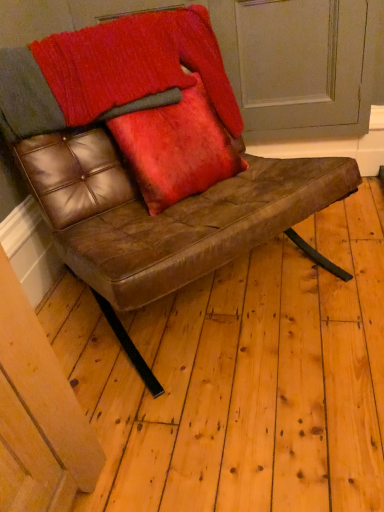
Question: Is brown leather chair at center aimed at velvet red cushion at center?

Choices:
 (A) no
 (B) yes

Answer: (B)

Question: Is brown leather chair at center smaller than velvet red cushion at center?

Choices:
 (A) yes
 (B) no

Answer: (B)

Question: Is brown leather chair at center facing away from velvet red cushion at center?

Choices:
 (A) no
 (B) yes

Answer: (B)

Question: Does brown leather chair at center appear on the right side of velvet red cushion at center?

Choices:
 (A) no
 (B) yes

Answer: (A)

Question: Can you confirm if brown leather chair at center is shorter than velvet red cushion at center?

Choices:
 (A) yes
 (B) no

Answer: (B)

Question: Does brown leather chair at center have a lesser width compared to velvet red cushion at center?

Choices:
 (A) yes
 (B) no

Answer: (B)

Question: Can you confirm if velvet red cushion at center is positioned to the right of brown leather chair at center?

Choices:
 (A) yes
 (B) no

Answer: (A)

Question: Is velvet red cushion at center looking in the opposite direction of brown leather chair at center?

Choices:
 (A) no
 (B) yes

Answer: (B)

Question: Does velvet red cushion at center have a greater height compared to brown leather chair at center?

Choices:
 (A) no
 (B) yes

Answer: (A)

Question: Is velvet red cushion at center further to the viewer compared to brown leather chair at center?

Choices:
 (A) yes
 (B) no

Answer: (A)

Question: Can you confirm if velvet red cushion at center is wider than brown leather chair at center?

Choices:
 (A) no
 (B) yes

Answer: (A)

Question: Does velvet red cushion at center have a lesser height compared to brown leather chair at center?

Choices:
 (A) no
 (B) yes

Answer: (B)

Question: In terms of size, does brown leather chair at center appear bigger or smaller than velvet red cushion at center?

Choices:
 (A) big
 (B) small

Answer: (A)